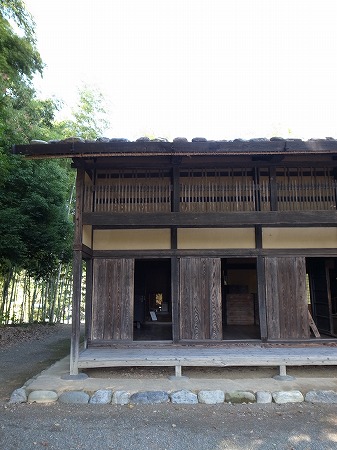
You are a GUI agent. You are given a task and a screenshot of the screen. Output one action in this format:
    pyautogui.click(x=<x>, y=<y>)
    Task: Click on the floor
    The width and height of the screenshot is (337, 450).
    Given the screenshot: What is the action you would take?
    pyautogui.click(x=114, y=433), pyautogui.click(x=39, y=349)